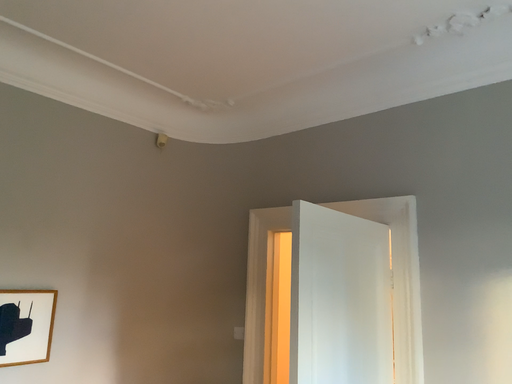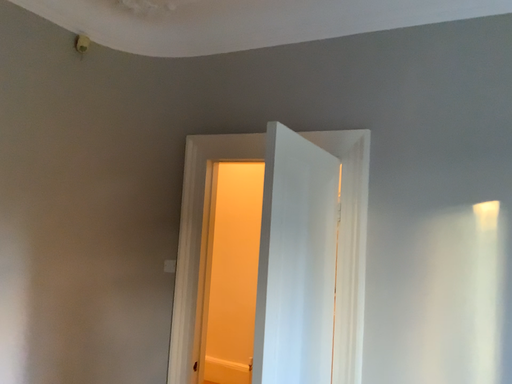
Question: Which way did the camera rotate in the video?

Choices:
 (A) rotated right
 (B) rotated left

Answer: (A)